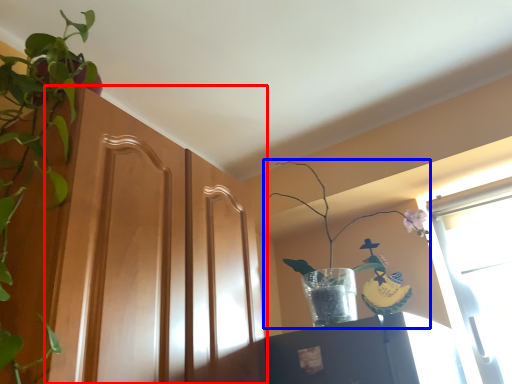
Question: Among these objects, which one is farthest to the camera, screen door (highlighted by a red box) or houseplant (highlighted by a blue box)?

Choices:
 (A) screen door
 (B) houseplant

Answer: (B)